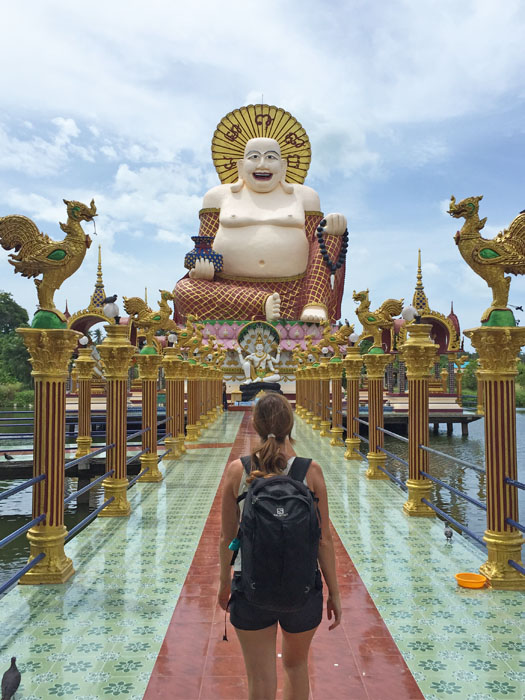
The image size is (525, 700). I want to click on buddha statue, so point(256,213), point(257,360).